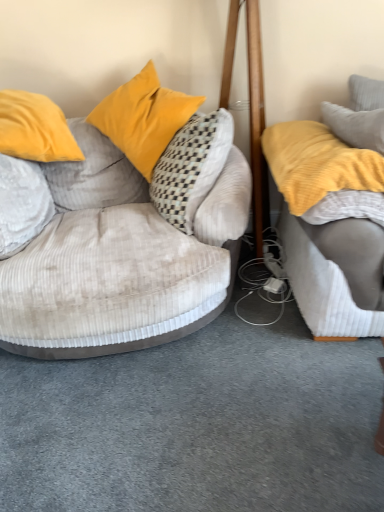
Image resolution: width=384 pixels, height=512 pixels. What do you see at coordinates (328, 298) in the screenshot?
I see `yellow soft fabric studio couch at right, which ranks as the second studio couch in left-to-right order` at bounding box center [328, 298].

Describe the element at coordinates (317, 163) in the screenshot. I see `yellow corduroy pillow at right, arranged as the 3th pillow when viewed from the left` at that location.

The width and height of the screenshot is (384, 512). I want to click on soft white pillow at left, positioned as the 4th pillow in right-to-left order, so click(x=22, y=204).

Identify the location of velvet yellow pillow at upper left, which is counted as the second pillow, starting from the left. This screenshot has width=384, height=512. (143, 118).

Which is in front, point (192, 99) or point (377, 82)?

The point (192, 99) is closer to the camera.

Is velvet yellow pillow at upper left, which is the third pillow in right-to-left order, to the left or to the right of gray textured pillow at upper right, the 1th pillow from the right, in the image?

Clearly, velvet yellow pillow at upper left, which is the third pillow in right-to-left order, is on the left of gray textured pillow at upper right, the 1th pillow from the right, in the image.

From the picture: From the image's perspective, relative to gray textured pillow at upper right, the 1th pillow from the right, is velvet yellow pillow at upper left, which is the third pillow in right-to-left order, above or below?

From the image's perspective, velvet yellow pillow at upper left, which is the third pillow in right-to-left order, appears below gray textured pillow at upper right, the 1th pillow from the right.

Is velvet yellow pillow at upper left, which is the third pillow in right-to-left order, situated inside gray textured pillow at upper right, the fourth pillow positioned from the left, or outside?

velvet yellow pillow at upper left, which is the third pillow in right-to-left order, exists outside the volume of gray textured pillow at upper right, the fourth pillow positioned from the left.

Is yellow soft fabric studio couch at right, which appears as the 1th studio couch when viewed from the right, in front of yellow corduroy pillow at right, which is the 2th pillow in right-to-left order?

Yes, it is in front of yellow corduroy pillow at right, which is the 2th pillow in right-to-left order.

From the image's perspective, which one is positioned higher, yellow soft fabric studio couch at right, which ranks as the second studio couch in left-to-right order, or yellow corduroy pillow at right, which is the 2th pillow in right-to-left order?

yellow soft fabric studio couch at right, which ranks as the second studio couch in left-to-right order, is shown above in the image.

Who is taller, yellow soft fabric studio couch at right, which ranks as the second studio couch in left-to-right order, or yellow corduroy pillow at right, arranged as the 3th pillow when viewed from the left?

Standing taller between the two is yellow soft fabric studio couch at right, which ranks as the second studio couch in left-to-right order.

Which point is more distant from viewer, (308, 291) or (324, 129)?

The point (324, 129) is farther from the camera.

From a real-world perspective, between yellow soft fabric studio couch at right, which ranks as the second studio couch in left-to-right order, and soft white pillow at left, positioned as the 4th pillow in right-to-left order, who is vertically higher?

From a 3D spatial view, yellow soft fabric studio couch at right, which ranks as the second studio couch in left-to-right order, is above.

Is yellow soft fabric studio couch at right, which appears as the 1th studio couch when viewed from the right, not inside soft white pillow at left, positioned as the 4th pillow in right-to-left order?

Indeed, yellow soft fabric studio couch at right, which appears as the 1th studio couch when viewed from the right, is completely outside soft white pillow at left, positioned as the 4th pillow in right-to-left order.

Which point is more forward, [330,272] or [4,181]?

The point [330,272] is closer.

I want to click on the 2nd studio couch to the right of the soft white pillow at left, positioned as the 4th pillow in right-to-left order, starting your count from the anchor, so pyautogui.click(x=328, y=298).

Considering the relative positions of yellow corduroy pillow at right, which is the 2th pillow in right-to-left order, and soft white pillow at left, positioned as the 4th pillow in right-to-left order, in the image provided, is yellow corduroy pillow at right, which is the 2th pillow in right-to-left order, to the left of soft white pillow at left, positioned as the 4th pillow in right-to-left order, from the viewer's perspective?

In fact, yellow corduroy pillow at right, which is the 2th pillow in right-to-left order, is to the right of soft white pillow at left, positioned as the 4th pillow in right-to-left order.

Is yellow corduroy pillow at right, arranged as the 3th pillow when viewed from the left, wider than soft white pillow at left, the 1th pillow from the left?

Yes, yellow corduroy pillow at right, arranged as the 3th pillow when viewed from the left, is wider than soft white pillow at left, the 1th pillow from the left.

Is point (325, 133) in front of point (25, 189)?

No.

From a real-world perspective, which object stands above the other?

From a 3D spatial view, gray textured pillow at upper right, the 1th pillow from the right, is above.

Considering the relative positions of gray textured pillow at upper right, the fourth pillow positioned from the left, and velvet yellow pillow at upper left, which is counted as the second pillow, starting from the left, in the image provided, is gray textured pillow at upper right, the fourth pillow positioned from the left, to the left or to the right of velvet yellow pillow at upper left, which is counted as the second pillow, starting from the left,?

gray textured pillow at upper right, the fourth pillow positioned from the left, is to the right of velvet yellow pillow at upper left, which is counted as the second pillow, starting from the left.

Is gray textured pillow at upper right, the fourth pillow positioned from the left, looking in the opposite direction of velvet yellow pillow at upper left, which is the third pillow in right-to-left order?

No, velvet yellow pillow at upper left, which is the third pillow in right-to-left order, is not at the back of gray textured pillow at upper right, the fourth pillow positioned from the left.

Considering the relative sizes of gray textured pillow at upper right, the fourth pillow positioned from the left, and velvet yellow pillow at upper left, which is counted as the second pillow, starting from the left, in the image provided, is gray textured pillow at upper right, the fourth pillow positioned from the left, taller than velvet yellow pillow at upper left, which is counted as the second pillow, starting from the left,?

In fact, gray textured pillow at upper right, the fourth pillow positioned from the left, may be shorter than velvet yellow pillow at upper left, which is counted as the second pillow, starting from the left.

Which is more distant, (328, 331) or (84, 173)?

The point (84, 173) is more distant.

Considering the sizes of yellow soft fabric studio couch at right, which appears as the 1th studio couch when viewed from the right, and velvet beige studio couch at left, which is counted as the first studio couch, starting from the left, in the image, is yellow soft fabric studio couch at right, which appears as the 1th studio couch when viewed from the right, wider or thinner than velvet beige studio couch at left, which is counted as the first studio couch, starting from the left,?

In the image, yellow soft fabric studio couch at right, which appears as the 1th studio couch when viewed from the right, appears to be more narrow than velvet beige studio couch at left, which is counted as the first studio couch, starting from the left.

Is yellow soft fabric studio couch at right, which ranks as the second studio couch in left-to-right order, in front of or behind velvet beige studio couch at left, which is counted as the 2th studio couch, starting from the right, in the image?

In the image, yellow soft fabric studio couch at right, which ranks as the second studio couch in left-to-right order, appears behind velvet beige studio couch at left, which is counted as the 2th studio couch, starting from the right.

Based on the photo, considering the sizes of yellow soft fabric studio couch at right, which appears as the 1th studio couch when viewed from the right, and velvet beige studio couch at left, which is counted as the 2th studio couch, starting from the right, in the image, is yellow soft fabric studio couch at right, which appears as the 1th studio couch when viewed from the right, taller or shorter than velvet beige studio couch at left, which is counted as the 2th studio couch, starting from the right,?

yellow soft fabric studio couch at right, which appears as the 1th studio couch when viewed from the right, is shorter than velvet beige studio couch at left, which is counted as the 2th studio couch, starting from the right.

Consider the image. How different are the orientations of soft white pillow at left, the 1th pillow from the left, and gray textured pillow at upper right, the fourth pillow positioned from the left, in degrees?

There is a 106-degree angle between the facing directions of soft white pillow at left, the 1th pillow from the left, and gray textured pillow at upper right, the fourth pillow positioned from the left.

From a real-world perspective, relative to gray textured pillow at upper right, the fourth pillow positioned from the left, is soft white pillow at left, positioned as the 4th pillow in right-to-left order, vertically above or below?

In terms of real-world spatial position, soft white pillow at left, positioned as the 4th pillow in right-to-left order, is below gray textured pillow at upper right, the fourth pillow positioned from the left.

From the image's perspective, which is below, soft white pillow at left, the 1th pillow from the left, or gray textured pillow at upper right, the fourth pillow positioned from the left?

soft white pillow at left, the 1th pillow from the left, is shown below in the image.

Is soft white pillow at left, positioned as the 4th pillow in right-to-left order, far from gray textured pillow at upper right, the fourth pillow positioned from the left?

soft white pillow at left, positioned as the 4th pillow in right-to-left order, is far away from gray textured pillow at upper right, the fourth pillow positioned from the left.

Locate an element on the screen. pillow above the velvet yellow pillow at upper left, which is the third pillow in right-to-left order (from the image's perspective) is located at coordinates (365, 93).

The width and height of the screenshot is (384, 512). I want to click on pillow that is the 1st one when counting leftward from the yellow soft fabric studio couch at right, which appears as the 1th studio couch when viewed from the right, so click(x=317, y=163).

Looking at the image, which one is located further to soft white pillow at left, positioned as the 4th pillow in right-to-left order, gray textured pillow at upper right, the 1th pillow from the right, or yellow corduroy pillow at right, which is the 2th pillow in right-to-left order?

The object further to soft white pillow at left, positioned as the 4th pillow in right-to-left order, is gray textured pillow at upper right, the 1th pillow from the right.

Based on their spatial positions, is gray textured pillow at upper right, the fourth pillow positioned from the left, or soft white pillow at left, the 1th pillow from the left, further from yellow corduroy pillow at right, which is the 2th pillow in right-to-left order?

Among the two, soft white pillow at left, the 1th pillow from the left, is located further to yellow corduroy pillow at right, which is the 2th pillow in right-to-left order.

Which object lies nearer to the anchor point soft white pillow at left, the 1th pillow from the left, velvet yellow pillow at upper left, which is the third pillow in right-to-left order, or gray textured pillow at upper right, the 1th pillow from the right?

velvet yellow pillow at upper left, which is the third pillow in right-to-left order, is closer to soft white pillow at left, the 1th pillow from the left.

Considering their positions, is velvet yellow pillow at upper left, which is the third pillow in right-to-left order, positioned closer to soft white pillow at left, positioned as the 4th pillow in right-to-left order, than velvet beige studio couch at left, which is counted as the 2th studio couch, starting from the right?

velvet beige studio couch at left, which is counted as the 2th studio couch, starting from the right, is positioned closer to the anchor soft white pillow at left, positioned as the 4th pillow in right-to-left order.

Considering their positions, is soft white pillow at left, positioned as the 4th pillow in right-to-left order, positioned closer to gray textured pillow at upper right, the 1th pillow from the right, than velvet beige studio couch at left, which is counted as the first studio couch, starting from the left?

velvet beige studio couch at left, which is counted as the first studio couch, starting from the left, lies closer to gray textured pillow at upper right, the 1th pillow from the right, than the other object.

Estimate the real-world distances between objects in this image. Which object is closer to yellow soft fabric studio couch at right, which ranks as the second studio couch in left-to-right order, yellow corduroy pillow at right, arranged as the 3th pillow when viewed from the left, or velvet yellow pillow at upper left, which is the third pillow in right-to-left order?

yellow corduroy pillow at right, arranged as the 3th pillow when viewed from the left, lies closer to yellow soft fabric studio couch at right, which ranks as the second studio couch in left-to-right order, than the other object.

From the image, which object appears to be farther from yellow soft fabric studio couch at right, which appears as the 1th studio couch when viewed from the right, velvet beige studio couch at left, which is counted as the first studio couch, starting from the left, or gray textured pillow at upper right, the fourth pillow positioned from the left?

gray textured pillow at upper right, the fourth pillow positioned from the left, is further to yellow soft fabric studio couch at right, which appears as the 1th studio couch when viewed from the right.

When comparing their distances from velvet yellow pillow at upper left, which is the third pillow in right-to-left order, does soft white pillow at left, the 1th pillow from the left, or yellow soft fabric studio couch at right, which ranks as the second studio couch in left-to-right order, seem closer?

soft white pillow at left, the 1th pillow from the left, lies closer to velvet yellow pillow at upper left, which is the third pillow in right-to-left order, than the other object.

You are a GUI agent. You are given a task and a screenshot of the screen. Output one action in this format:
    pyautogui.click(x=<x>, y=<y>)
    Task: Click on the studio couch between velvet beige studio couch at left, which is counted as the 2th studio couch, starting from the right, and gray textured pillow at upper right, the fourth pillow positioned from the left
    
    Given the screenshot: What is the action you would take?
    pyautogui.click(x=328, y=298)

I want to click on pillow between soft white pillow at left, positioned as the 4th pillow in right-to-left order, and yellow corduroy pillow at right, arranged as the 3th pillow when viewed from the left, in the horizontal direction, so click(143, 118).

The width and height of the screenshot is (384, 512). I want to click on pillow between velvet yellow pillow at upper left, which is the third pillow in right-to-left order, and gray textured pillow at upper right, the 1th pillow from the right, from left to right, so click(317, 163).

What are the coordinates of `studio couch between velvet yellow pillow at upper left, which is counted as the second pillow, starting from the left, and gray textured pillow at upper right, the fourth pillow positioned from the left` in the screenshot? It's located at (328, 298).